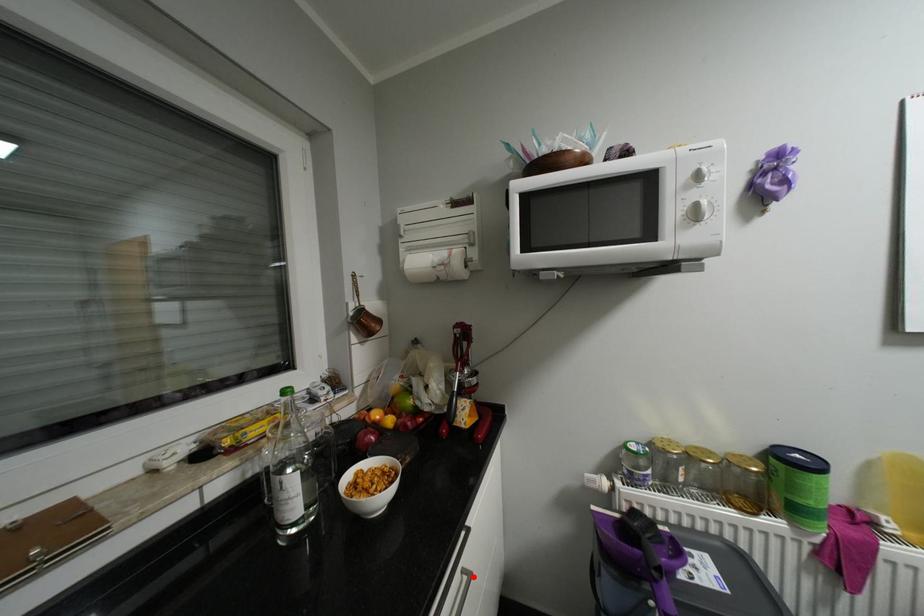
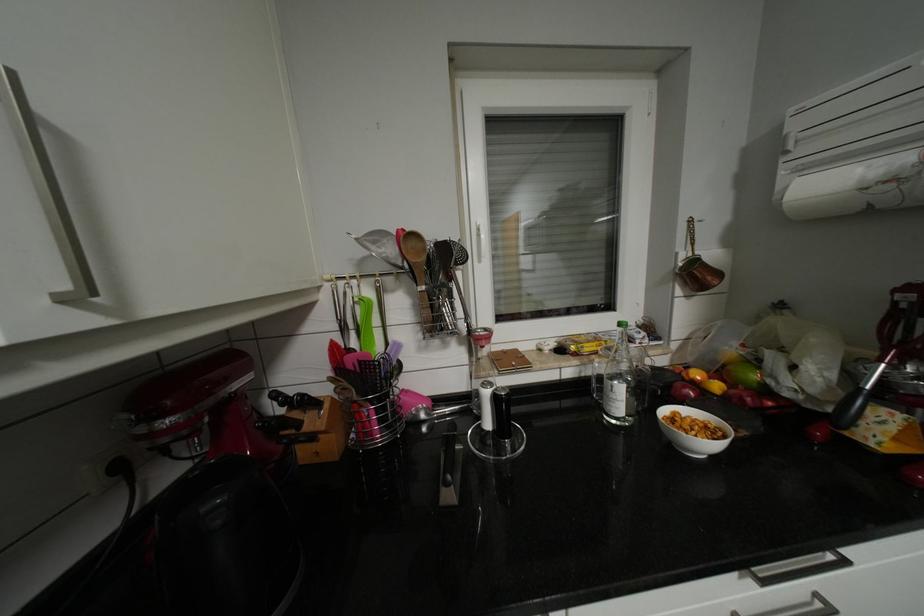
Question: I am providing you with two images of the same scene from different viewpoints. Given a red point in image1, look at the same physical point in image2. Is it:

Choices:
 (A) Closer to the viewpoint
 (B) Farther from the viewpoint

Answer: (A)